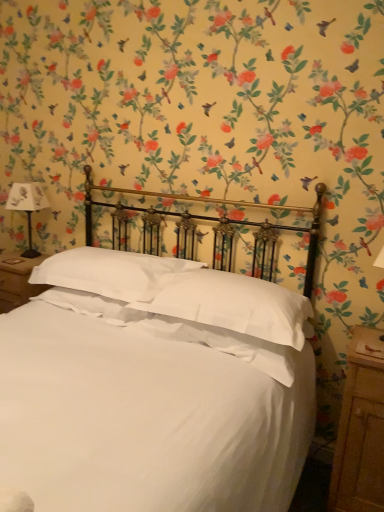
Question: Is wooden nightstand at right smaller than white satin bed at center?

Choices:
 (A) yes
 (B) no

Answer: (A)

Question: Considering the relative positions of wooden nightstand at right and white satin bed at center in the image provided, is wooden nightstand at right to the right of white satin bed at center from the viewer's perspective?

Choices:
 (A) yes
 (B) no

Answer: (A)

Question: Are wooden nightstand at right and white satin bed at center beside each other?

Choices:
 (A) no
 (B) yes

Answer: (A)

Question: Can we say wooden nightstand at right lies outside white satin bed at center?

Choices:
 (A) yes
 (B) no

Answer: (B)

Question: Considering the relative sizes of wooden nightstand at right and white satin bed at center in the image provided, is wooden nightstand at right thinner than white satin bed at center?

Choices:
 (A) yes
 (B) no

Answer: (A)

Question: Is point (8, 198) closer or farther from the camera than point (16, 315)?

Choices:
 (A) farther
 (B) closer

Answer: (A)

Question: From a real-world perspective, relative to white satin bed at center, is white paper lampshade at left vertically above or below?

Choices:
 (A) below
 (B) above

Answer: (B)

Question: In the image, is white paper lampshade at left positioned in front of or behind white satin bed at center?

Choices:
 (A) behind
 (B) front

Answer: (A)

Question: Do you think white paper lampshade at left is within white satin bed at center, or outside of it?

Choices:
 (A) outside
 (B) inside

Answer: (A)

Question: Considering their positions, is white soft pillow at center, which is counted as the 2th pillow, starting from the left, located in front of or behind white paper lampshade at left?

Choices:
 (A) front
 (B) behind

Answer: (A)

Question: From their relative heights in the image, would you say white soft pillow at center, which ranks as the 1th pillow in right-to-left order, is taller or shorter than white paper lampshade at left?

Choices:
 (A) short
 (B) tall

Answer: (A)

Question: Considering the positions of white soft pillow at center, which is counted as the 2th pillow, starting from the left, and white paper lampshade at left in the image, is white soft pillow at center, which is counted as the 2th pillow, starting from the left, wider or thinner than white paper lampshade at left?

Choices:
 (A) thin
 (B) wide

Answer: (B)

Question: From a real-world perspective, relative to white paper lampshade at left, is white soft pillow at center, which ranks as the 1th pillow in right-to-left order, vertically above or below?

Choices:
 (A) below
 (B) above

Answer: (A)

Question: From a real-world perspective, relative to wooden nightstand at right, is white paper lampshade at left vertically above or below?

Choices:
 (A) above
 (B) below

Answer: (A)

Question: Considering their positions, is white paper lampshade at left located in front of or behind wooden nightstand at right?

Choices:
 (A) behind
 (B) front

Answer: (A)